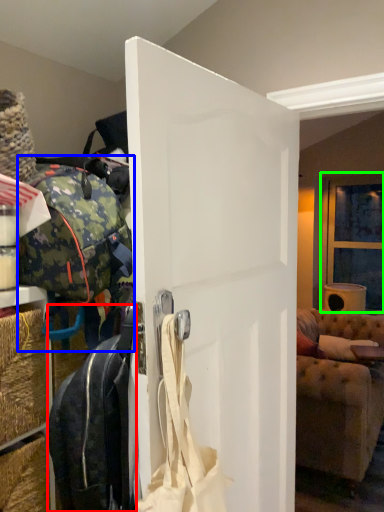
Question: Which object is the closest to the luggage and bags (highlighted by a red box)? Choose among these: luggage and bags (highlighted by a blue box) or window (highlighted by a green box).

Choices:
 (A) luggage and bags
 (B) window

Answer: (A)